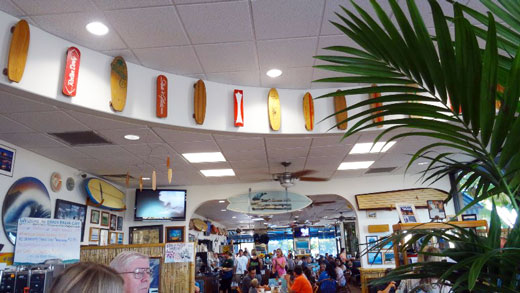
Identify the location of tv. (150, 205).